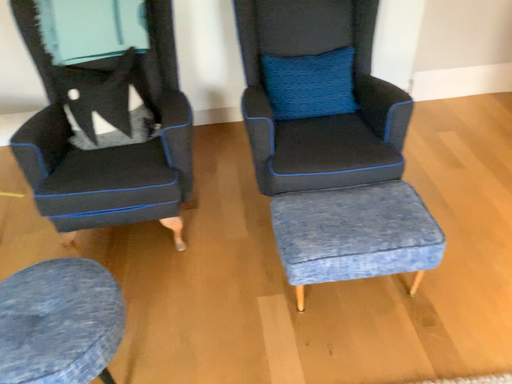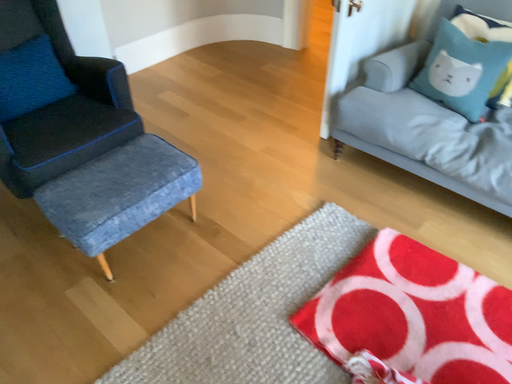
Question: Which way did the camera rotate in the video?

Choices:
 (A) rotated downward
 (B) rotated upward

Answer: (B)